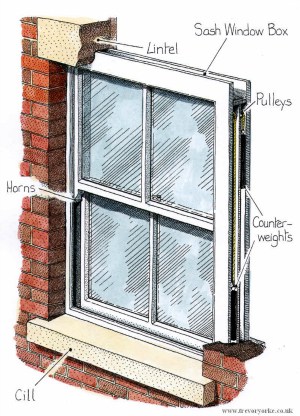
Find the location of a particular element. Image resolution: width=300 pixels, height=416 pixels. illustrated window pane is located at coordinates (126, 152), (191, 273), (188, 154), (114, 267).